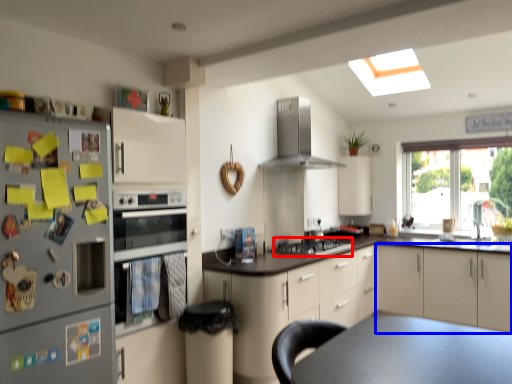
Question: Among these objects, which one is nearest to the camera, gas stove (highlighted by a red box) or cabinetry (highlighted by a blue box)?

Choices:
 (A) gas stove
 (B) cabinetry

Answer: (A)